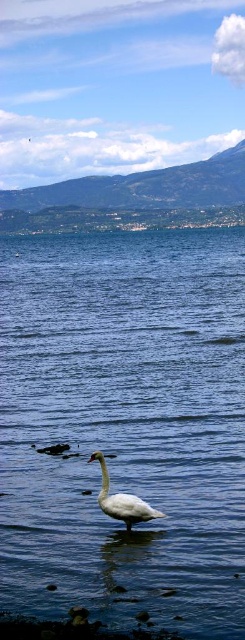
Question: Which point is farther to the camera?

Choices:
 (A) white matte swan at center
 (B) blue water at center

Answer: (A)

Question: Which object appears closest to the camera in this image?

Choices:
 (A) blue water at center
 (B) white matte swan at center

Answer: (A)

Question: Where is blue water at center located in relation to white matte swan at center in the image?

Choices:
 (A) right
 (B) left

Answer: (B)

Question: Is blue water at center above white matte swan at center?

Choices:
 (A) yes
 (B) no

Answer: (A)

Question: Can you confirm if blue water at center is positioned to the left of white matte swan at center?

Choices:
 (A) no
 (B) yes

Answer: (B)